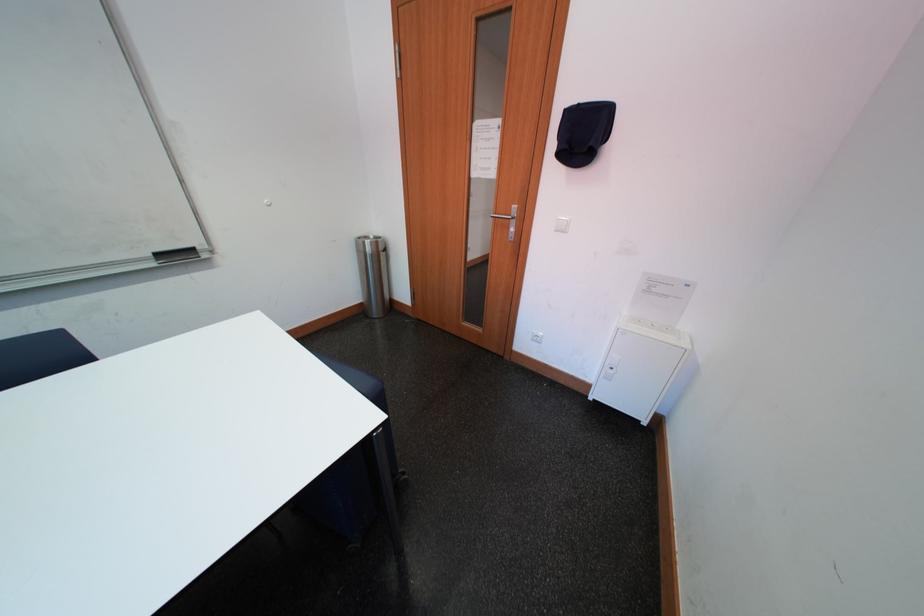
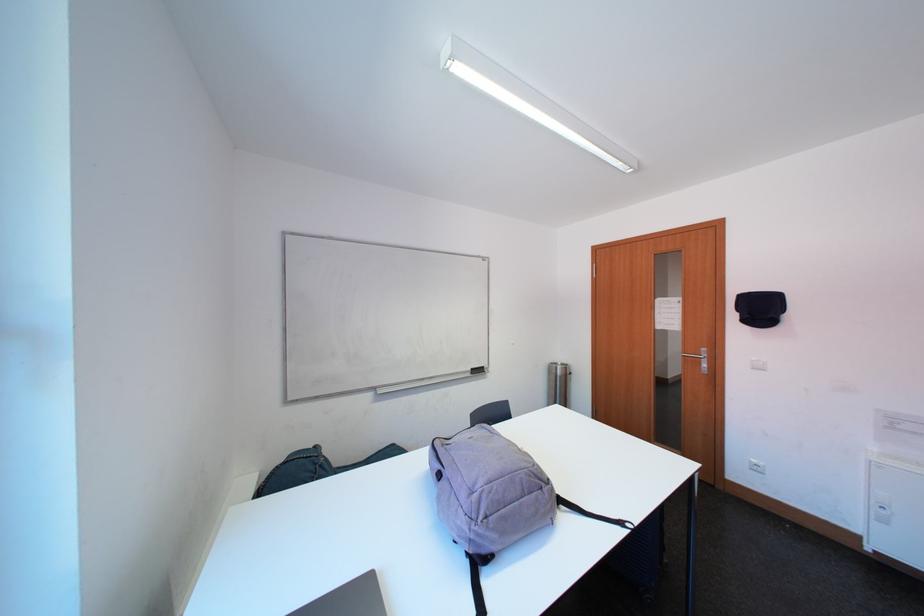
The point at (593, 140) is marked in the first image. Where is the corresponding point in the second image?

(771, 313)